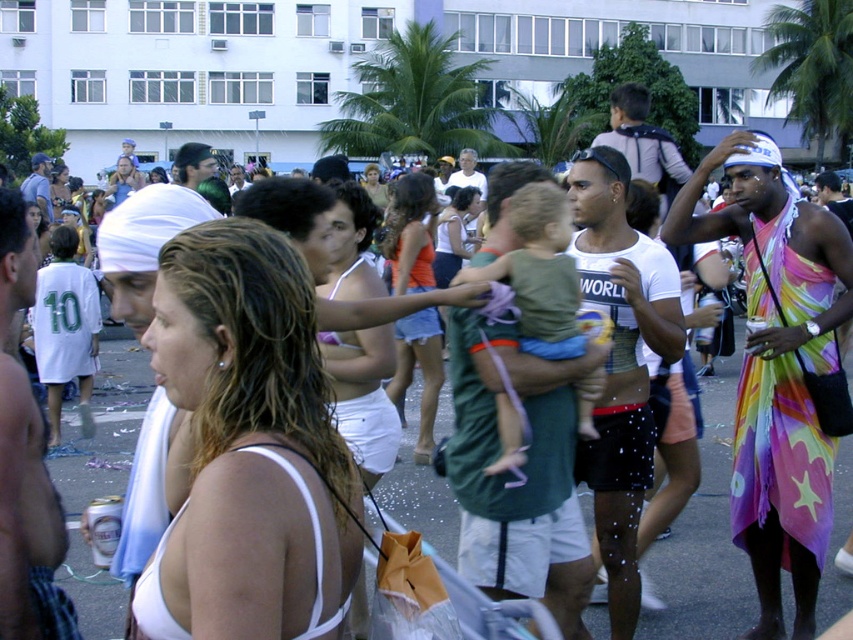
Question: Which point is farther to the camera?

Choices:
 (A) (407, 259)
 (B) (183, 380)

Answer: (A)

Question: Which point is farther to the camera?

Choices:
 (A) (764, 588)
 (B) (526, 198)

Answer: (A)

Question: Which point appears farthest from the camera in this image?

Choices:
 (A) tap(257, 401)
 (B) tap(408, 259)

Answer: (B)

Question: Is rainbow fabric dress at right positioned in front of orange fabric dress at center?

Choices:
 (A) no
 (B) yes

Answer: (B)

Question: Does white fabric bikini top at center appear on the left side of green cotton shirt at center?

Choices:
 (A) yes
 (B) no

Answer: (A)

Question: Considering the relative positions of green cotton shirt at center and orange fabric dress at center in the image provided, where is green cotton shirt at center located with respect to orange fabric dress at center?

Choices:
 (A) left
 (B) right

Answer: (B)